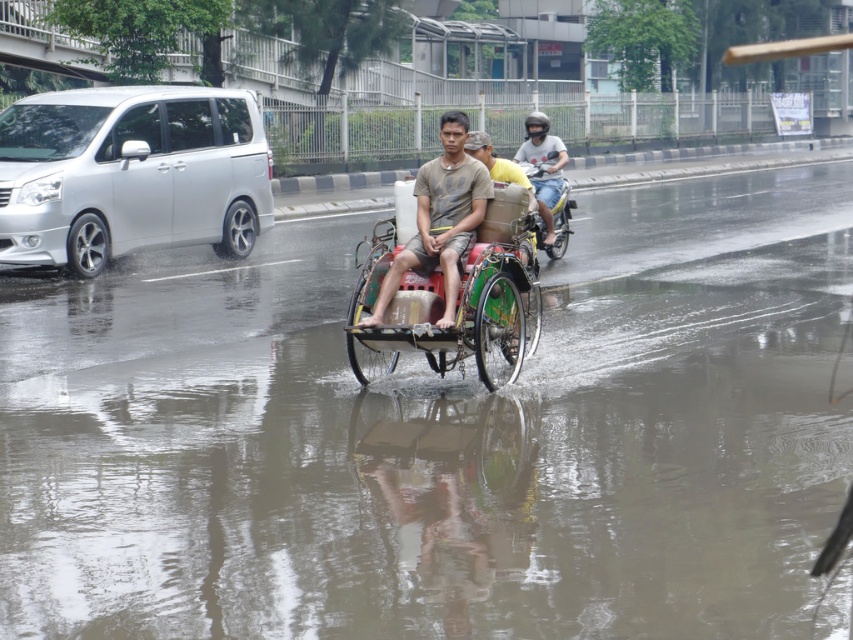
Does green matte cart at center appear on the right side of matte black helmet at upper center?

No, green matte cart at center is not to the right of matte black helmet at upper center.

Which is more to the right, green matte cart at center or matte black helmet at upper center?

matte black helmet at upper center

Between point (421, 284) and point (540, 202), which one is positioned behind?

The point (540, 202) is more distant.

This screenshot has width=853, height=640. I want to click on green matte cart at center, so click(x=456, y=300).

Which is below, silver metallic van at left or brown fabric tricycle at center?

brown fabric tricycle at center is lower down.

Does silver metallic van at left appear on the left side of brown fabric tricycle at center?

Yes, silver metallic van at left is to the left of brown fabric tricycle at center.

Describe the element at coordinates (131, 173) in the screenshot. I see `silver metallic van at left` at that location.

You are a GUI agent. You are given a task and a screenshot of the screen. Output one action in this format:
    pyautogui.click(x=<x>, y=<y>)
    Task: Click on the silver metallic van at left
    The image size is (853, 640).
    Given the screenshot: What is the action you would take?
    pyautogui.click(x=131, y=173)

Between silver metallic van at left and green matte cart at center, which one has more height?

silver metallic van at left

Locate an element on the screen. The image size is (853, 640). silver metallic van at left is located at coordinates (131, 173).

At what (x,y) coordinates should I click in order to perform the action: click on silver metallic van at left. Please return your answer as a coordinate pair (x, y). The image size is (853, 640). Looking at the image, I should click on (131, 173).